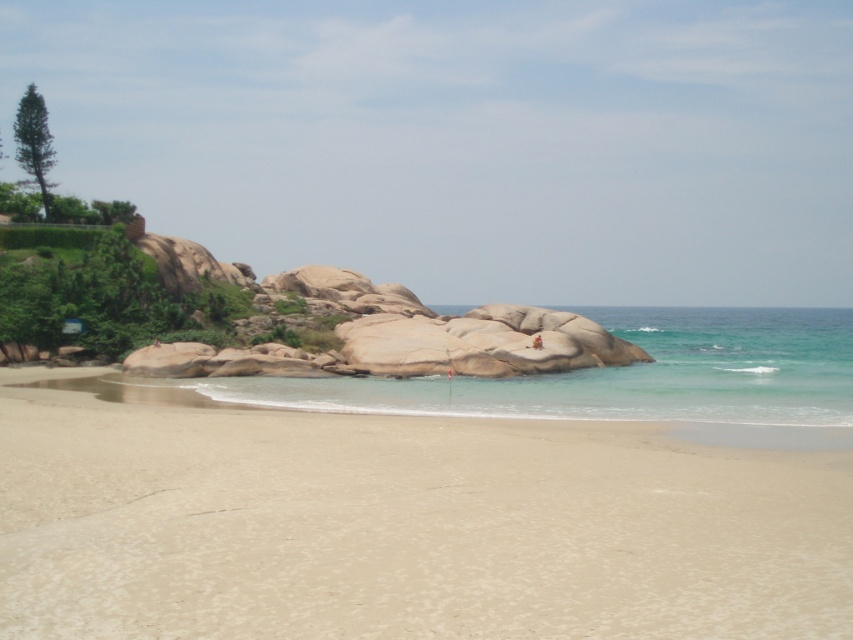
Question: Which of the following is the closest to the observer?

Choices:
 (A) smooth sand at center
 (B) clear blue water at center

Answer: (A)

Question: Is smooth sand at center positioned in front of clear blue water at center?

Choices:
 (A) yes
 (B) no

Answer: (A)

Question: Can you confirm if smooth sand at center is smaller than clear blue water at center?

Choices:
 (A) yes
 (B) no

Answer: (A)

Question: Among these points, which one is farthest from the camera?

Choices:
 (A) (467, 600)
 (B) (693, 340)

Answer: (B)

Question: Is smooth sand at center positioned in front of clear blue water at center?

Choices:
 (A) no
 (B) yes

Answer: (B)